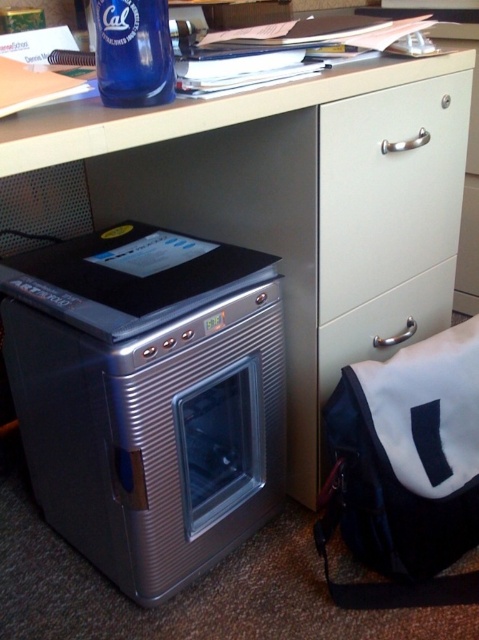
You are organizing your office and want to place a decorative item on the white matte cabinet handle at center. The handle is located at point coordinates of (389, 188). If the decorative item has a diameter of 0.1 units, will it fit entirely on the handle without overlapping the edges?

The white matte cabinet handle at center is located at point coordinates of (389, 188). Since the decorative item has a diameter of 0.1 units, it will fit entirely on the handle without overlapping the edges as long as the handle is large enough to accommodate the diameter. However, the exact dimensions of the handle are not provided, so we cannot confirm with certainty. But according to the given information, the point indicates the handle location, so placing the item there should be possible.

You are organizing the office and need to place a new rectangular box that is 12 inches wide. You have space next to the satin silver oven at lower left and the white matte drawer at center right. Which object can accommodate the box if the box must be placed adjacent to either without overlapping?

The satin silver oven at lower left can accommodate the box since its width is larger than the white matte drawer at center right, providing enough space for the 12 inch wide box.

You are organizing items in an office. You have a white matte cabinet handle at center and a blue glass bottle at upper left. Which object is bigger?

The white matte cabinet handle at center is larger in size than the blue glass bottle at upper left.